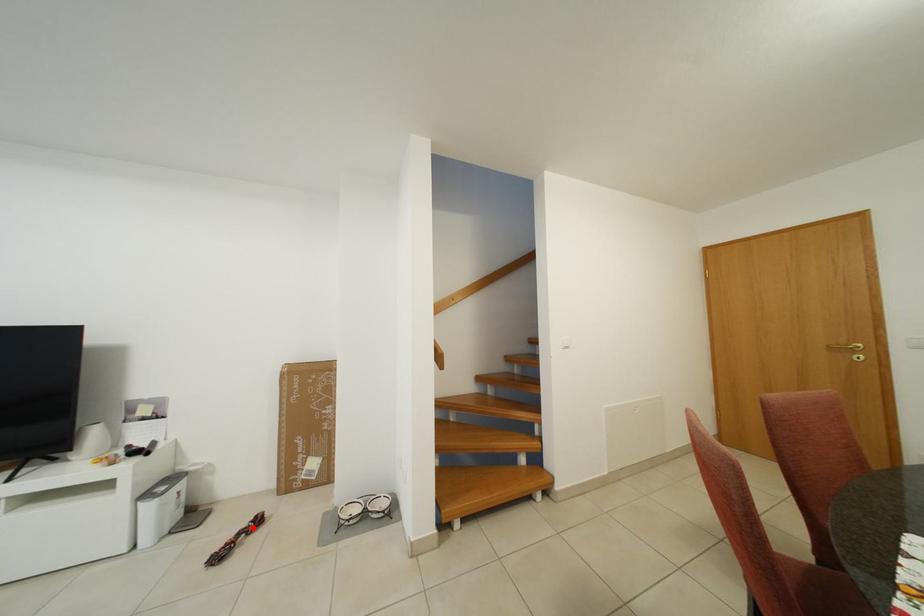
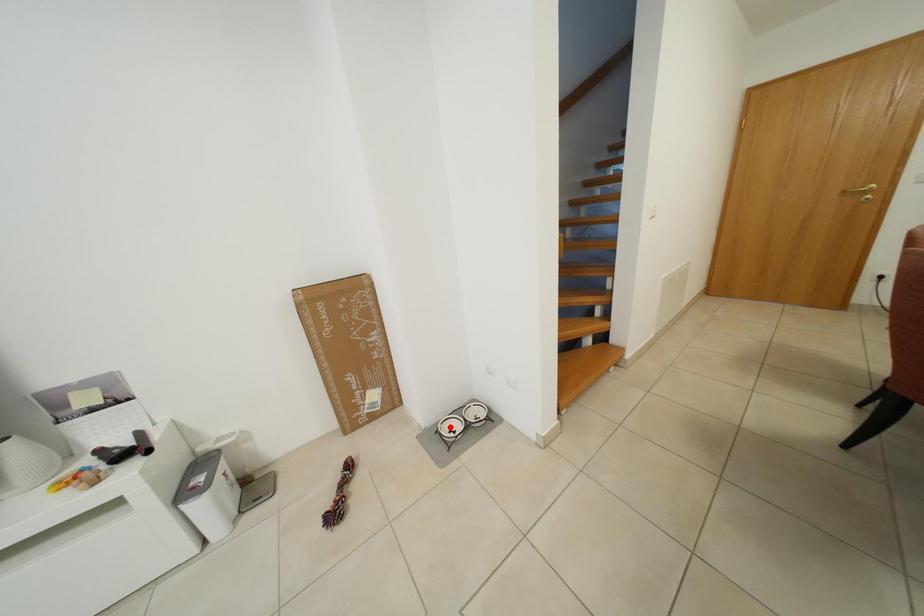
Based on the photo, I am providing you with two images of the same scene from different viewpoints. A red point is marked on the first image and another point is marked on the second image. Are the points marked in image1 and image2 representing the same 3D position?

No